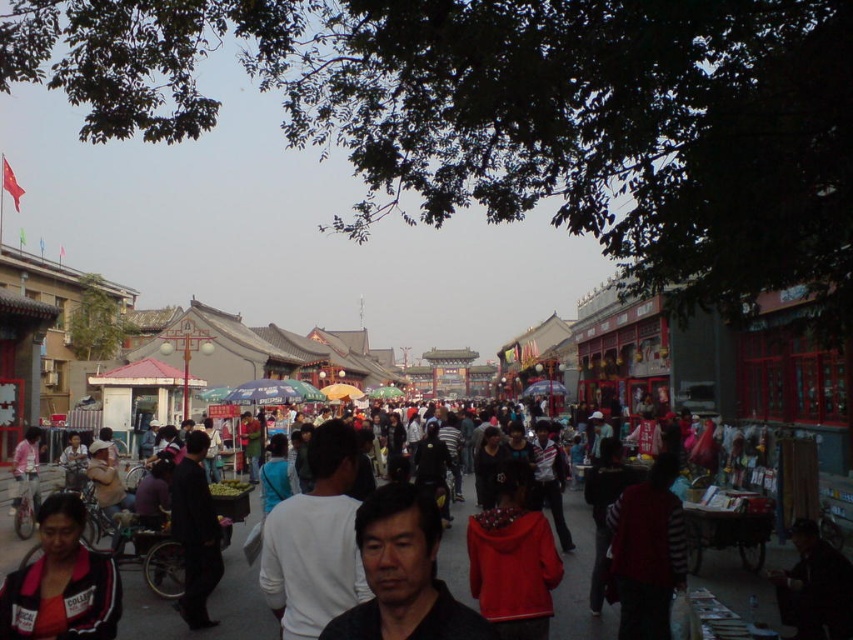
You are a photographer trying to capture a shot of the striped sweater at center without including the matte black jacket at lower left in the frame. Given their sizes, can you position yourself in a way to achieve this?

The matte black jacket at lower left is wider than the striped sweater at center. By positioning yourself to the side of the striped sweater at center and angling the camera away from the matte black jacket at lower left, you can avoid including it in the frame while focusing on the smaller striped sweater at center.

You are standing at the origin point in this crowded street market. A person wearing a dark gray shirt at center is located at coordinates 0.898 in the x direction and 0.474 in the y direction. If you want to move towards them, in which general direction should you walk? Please state your answer as either north, south, east, or west.

The dark gray shirt at center is located at coordinates x 0.898 and y 0.474. Since the x coordinate is greater than 0.5, you should walk east to reach them.

In the scene shown: You are a photographer trying to capture a candid shot of the striped sweater at center and the matte pink shirt at lower left. Which clothing item would you need to zoom in more on to ensure it fills the frame appropriately?

The striped sweater at center is smaller than the matte pink shirt at lower left, so you would need to zoom in more on the striped sweater at center to ensure it fills the frame appropriately.